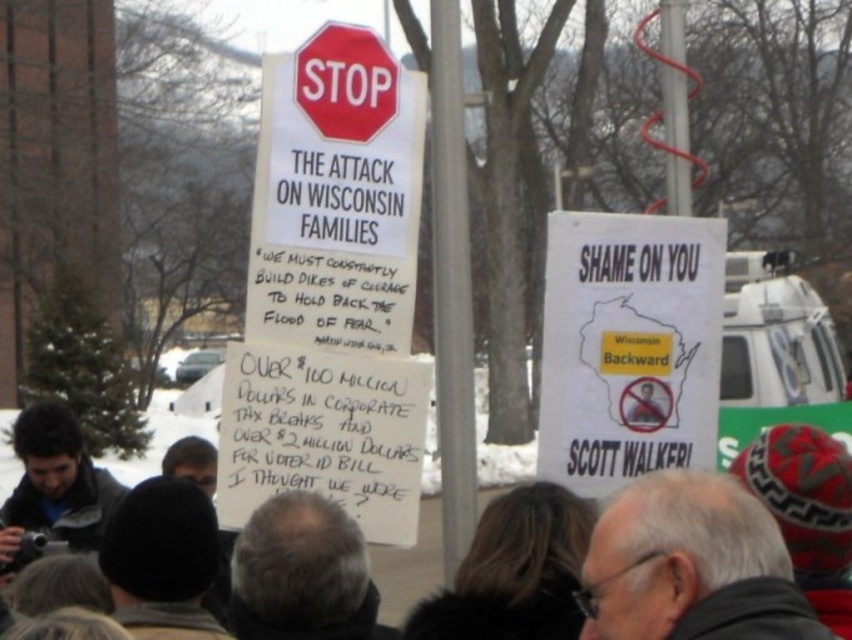
Between gray hair at upper right and dark gray jacket at lower left, which one is positioned lower?

Positioned lower is dark gray jacket at lower left.

How much distance is there between gray hair at upper right and dark gray jacket at lower left?

gray hair at upper right and dark gray jacket at lower left are 20.85 feet apart.

Who is more distant from viewer, (718, 605) or (61, 452)?

Point (61, 452)

The width and height of the screenshot is (852, 640). Identify the location of gray hair at upper right. point(689,564).

Can you confirm if white paper poster at center right is positioned to the left of red glossy stop sign at upper center?

In fact, white paper poster at center right is to the right of red glossy stop sign at upper center.

Can you confirm if white paper poster at center right is wider than red glossy stop sign at upper center?

Yes, white paper poster at center right is wider than red glossy stop sign at upper center.

The image size is (852, 640). I want to click on white paper poster at center right, so click(628, 346).

Is point (171, 426) farther from camera compared to point (83, 509)?

Yes.

Can you confirm if dark gray knit hat at center is bigger than dark gray jacket at lower left?

Yes.

What do you see at coordinates (409, 564) in the screenshot? I see `dark gray knit hat at center` at bounding box center [409, 564].

Locate an element on the screen. Image resolution: width=852 pixels, height=640 pixels. dark gray knit hat at center is located at coordinates (409, 564).